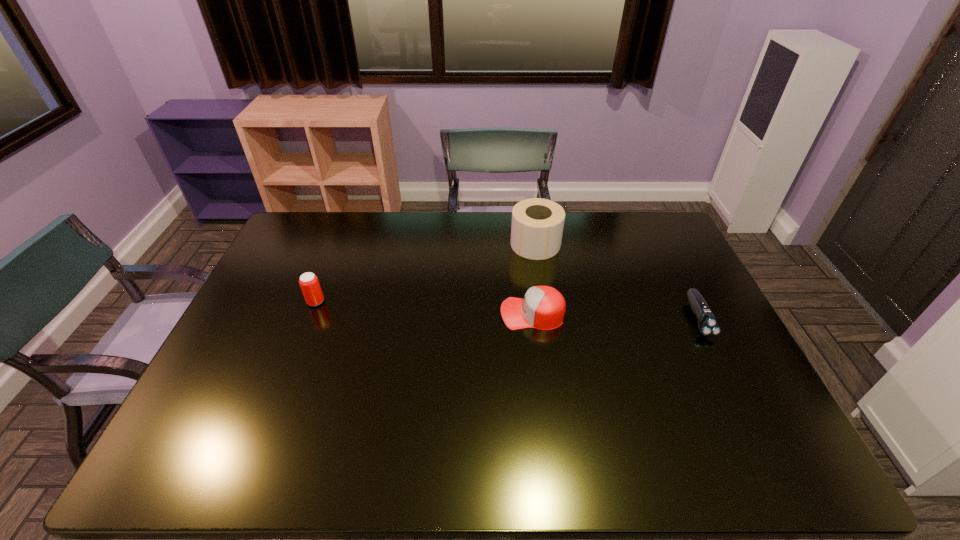
This screenshot has width=960, height=540. In order to click on free spot between the electric shaver and the tallest object in this screenshot , I will do `click(616, 281)`.

In order to click on free space between the farthest object and the third tallest object in this screenshot , I will do [534, 279].

Locate an element on the screen. empty location between the electric shaver and the third tallest object is located at coordinates (615, 316).

You are a GUI agent. You are given a task and a screenshot of the screen. Output one action in this format:
    pyautogui.click(x=<x>, y=<y>)
    Task: Click on the empty space that is in between the electric shaver and the second shortest object
    Image resolution: width=960 pixels, height=540 pixels.
    Given the screenshot: What is the action you would take?
    pyautogui.click(x=615, y=316)

This screenshot has width=960, height=540. What are the coordinates of `unoccupied area between the farthest object and the shortest object` in the screenshot? It's located at [x=616, y=281].

In order to click on vacant space that's between the second tallest object and the baseball cap in this screenshot , I will do `click(424, 308)`.

This screenshot has width=960, height=540. I want to click on empty space between the farthest object and the electric shaver, so click(x=616, y=281).

Locate an element on the screen. The width and height of the screenshot is (960, 540). empty space between the second tallest object and the baseball cap is located at coordinates (424, 308).

At what (x,y) coordinates should I click in order to perform the action: click on free spot between the third shortest object and the farthest object. Please return your answer as a coordinate pair (x, y). The image size is (960, 540). Looking at the image, I should click on (425, 273).

I want to click on object identified as the third closest to the baseball cap, so click(x=309, y=283).